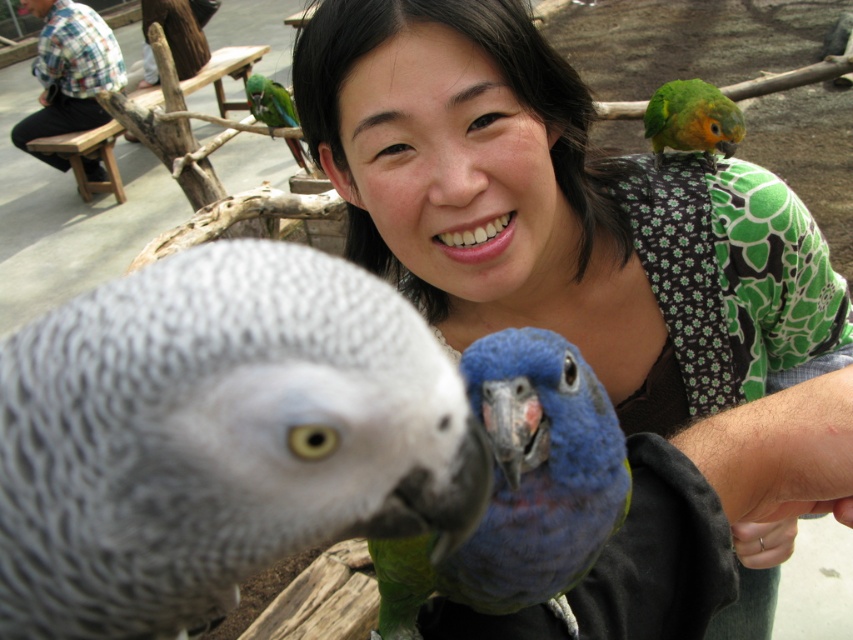
Between gray matte parrot at center and silver metallic ring on the right, which one is positioned higher?

gray matte parrot at center is higher up.

The image size is (853, 640). Describe the element at coordinates (218, 436) in the screenshot. I see `gray matte parrot at center` at that location.

Is point (474, 506) positioned before point (769, 544)?

Yes, it is.

At what (x,y) coordinates should I click in order to perform the action: click on gray matte parrot at center. Please return your answer as a coordinate pair (x, y). Looking at the image, I should click on (218, 436).

Which is more to the right, matte black shirt at upper center or green matte parrot at upper left?

matte black shirt at upper center is more to the right.

Does matte black shirt at upper center have a greater height compared to green matte parrot at upper left?

In fact, matte black shirt at upper center may be shorter than green matte parrot at upper left.

Does point (367, 228) lie behind point (250, 76)?

No, (367, 228) is closer to viewer.

The image size is (853, 640). What are the coordinates of `matte black shirt at upper center` in the screenshot? It's located at click(x=558, y=211).

The width and height of the screenshot is (853, 640). What do you see at coordinates (218, 436) in the screenshot?
I see `gray matte parrot at center` at bounding box center [218, 436].

Between point (241, 563) and point (300, 150), which one is positioned in front?

Point (241, 563) is more forward.

Describe the element at coordinates (218, 436) in the screenshot. I see `gray matte parrot at center` at that location.

Locate an element on the screen. The image size is (853, 640). gray matte parrot at center is located at coordinates (218, 436).